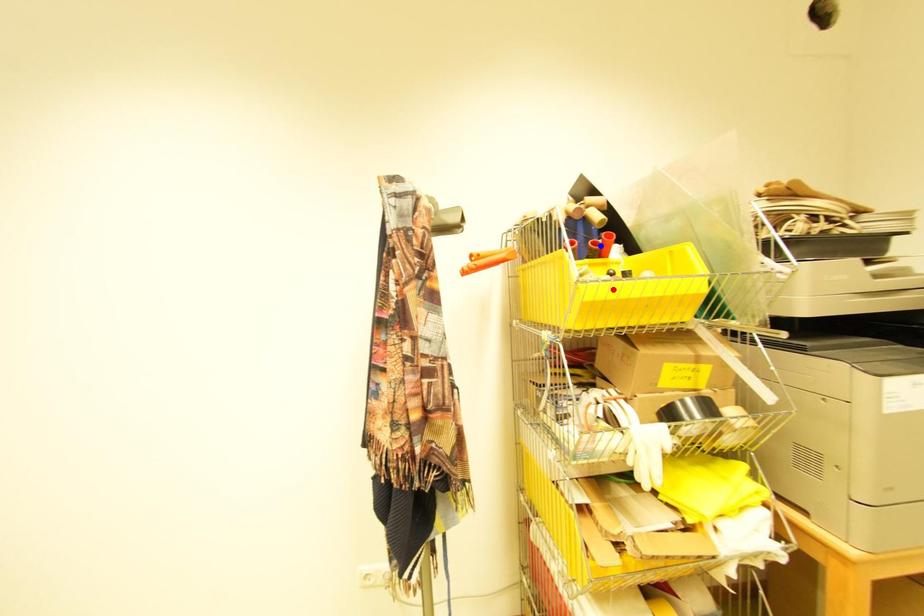
Question: Two points are marked on the image. Which point is closer to the camera?

Choices:
 (A) Blue point is closer.
 (B) Red point is closer.

Answer: (B)